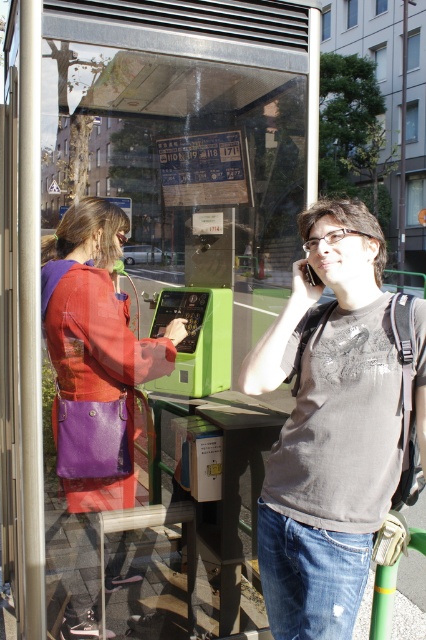
Question: Does matte gray t-shirt at center have a greater width compared to purple leather bag at left?

Choices:
 (A) no
 (B) yes

Answer: (A)

Question: Where is matte gray t-shirt at center located in relation to purple leather bag at left in the image?

Choices:
 (A) right
 (B) left

Answer: (A)

Question: From the image, what is the correct spatial relationship of matte gray t-shirt at center in relation to purple leather bag at left?

Choices:
 (A) left
 (B) right

Answer: (B)

Question: Which object appears farthest from the camera in this image?

Choices:
 (A) purple leather bag at left
 (B) matte gray t-shirt at center

Answer: (A)

Question: Which point appears farthest from the camera in this image?

Choices:
 (A) (305, 282)
 (B) (98, 211)

Answer: (B)